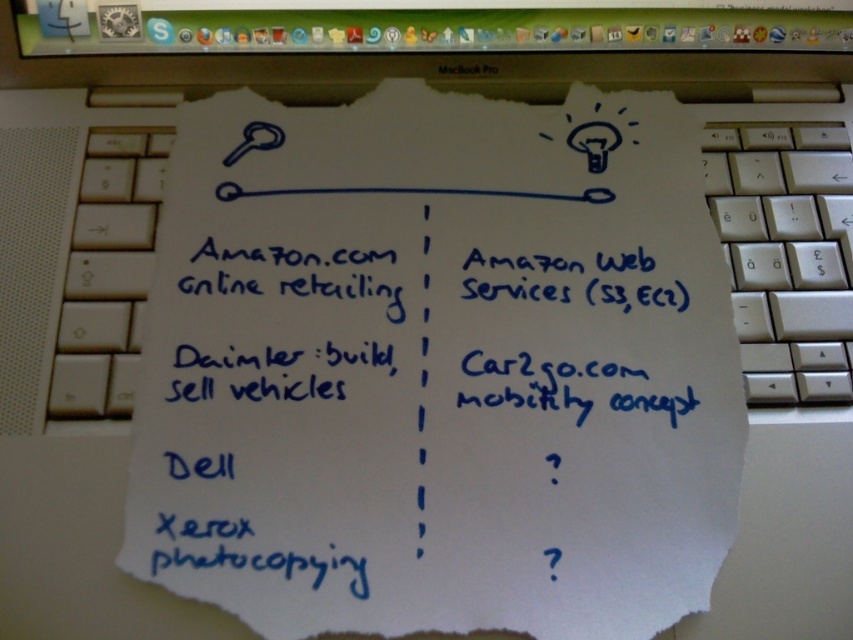
You are organizing a workspace and need to place a monitor stand that requires the screen to be narrower than the keyboard. Based on the image, can the black glossy computer screen at upper center fit on the stand designed for the white plastic keyboard at right?

A: The black glossy computer screen at upper center might be wider than the white plastic keyboard at right, so it may not fit on the stand designed for the keyboard unless adjusted.

You are setting up a desk for a student who needs to see both the black glossy computer screen at upper center and the white plastic keyboard at right clearly. Since the screen and keyboard have different heights, which one should you place higher to ensure the student can view them comfortably?

The white plastic keyboard at right should be placed higher than the black glossy computer screen at upper center because the keyboard is shorter in height compared to the screen, so elevating it would help the student see both comfortably.

You are a person sitting in front of the black glossy computer screen at upper center and the white plastic keyboard at right. Which object is closer to you?

The black glossy computer screen at upper center is closer to you because it is positioned further to the viewer than the white plastic keyboard at right.